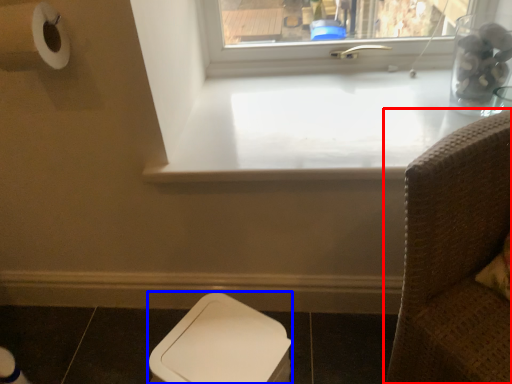
Question: Which object appears closest to the camera in this image, furniture (highlighted by a red box) or toilet bowl (highlighted by a blue box)?

Choices:
 (A) furniture
 (B) toilet bowl

Answer: (A)